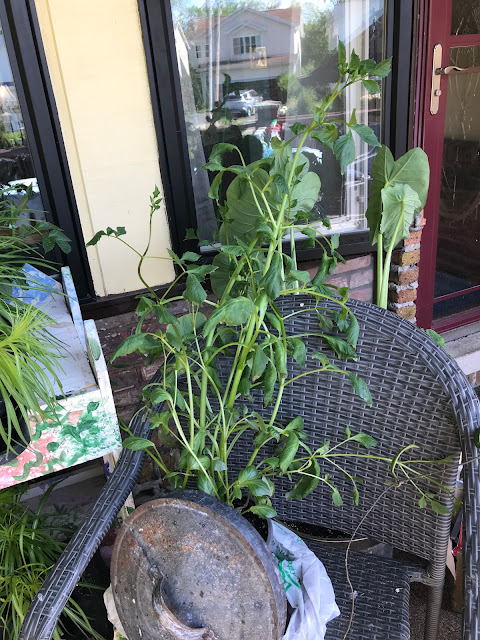
Identify the location of trash can. (262, 572).